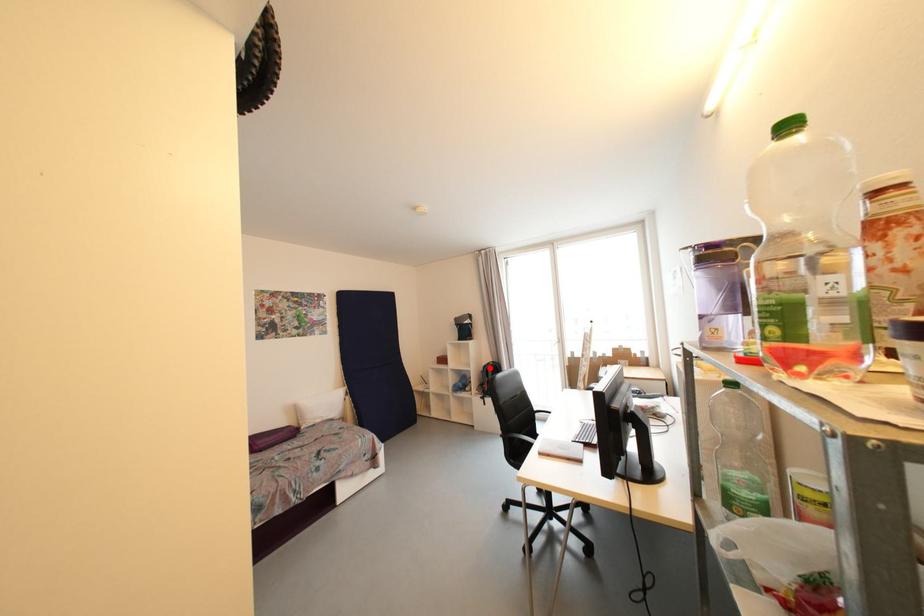
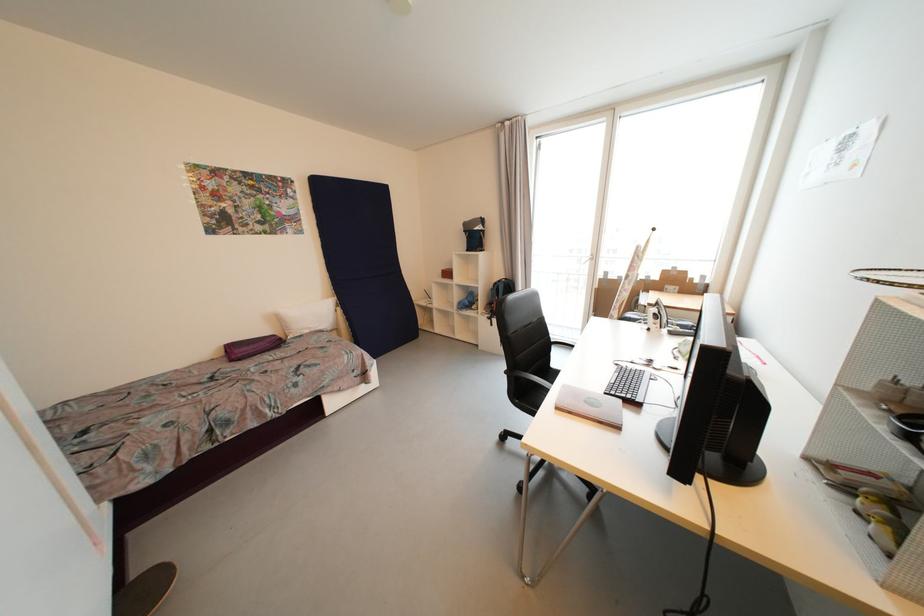
Question: I am providing you with two images of the same scene from different viewpoints. A red point is shown in image1. For the corresponding object point in image2, is it positioned nearer or farther from the camera?

Choices:
 (A) Nearer
 (B) Farther

Answer: (A)